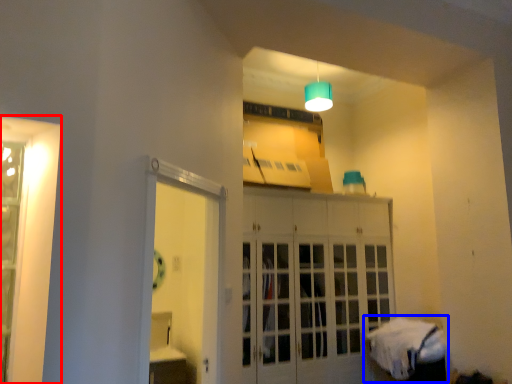
Question: Which object is closer to the camera taking this photo, window (highlighted by a red box) or bed (highlighted by a blue box)?

Choices:
 (A) window
 (B) bed

Answer: (A)